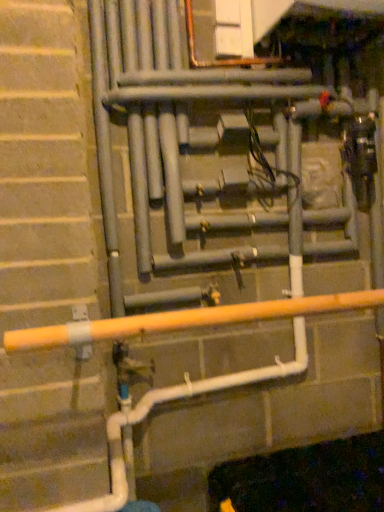
This screenshot has height=512, width=384. What do you see at coordinates (186, 320) in the screenshot?
I see `orange matte pipe at center` at bounding box center [186, 320].

The height and width of the screenshot is (512, 384). Identify the location of orange matte pipe at center. click(186, 320).

This screenshot has width=384, height=512. Find the location of `orange matte pipe at center`. orange matte pipe at center is located at coordinates (186, 320).